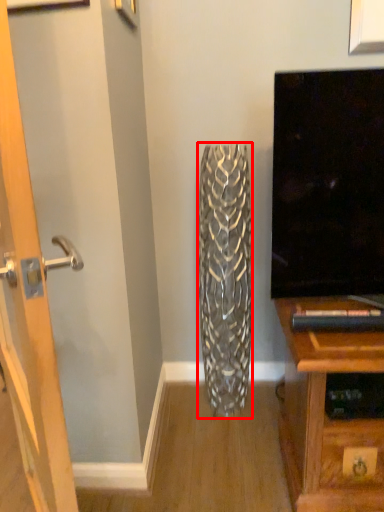
Question: From the image's perspective, what is the correct spatial positioning of vase (annotated by the red box) in reference to door?

Choices:
 (A) below
 (B) above

Answer: (B)